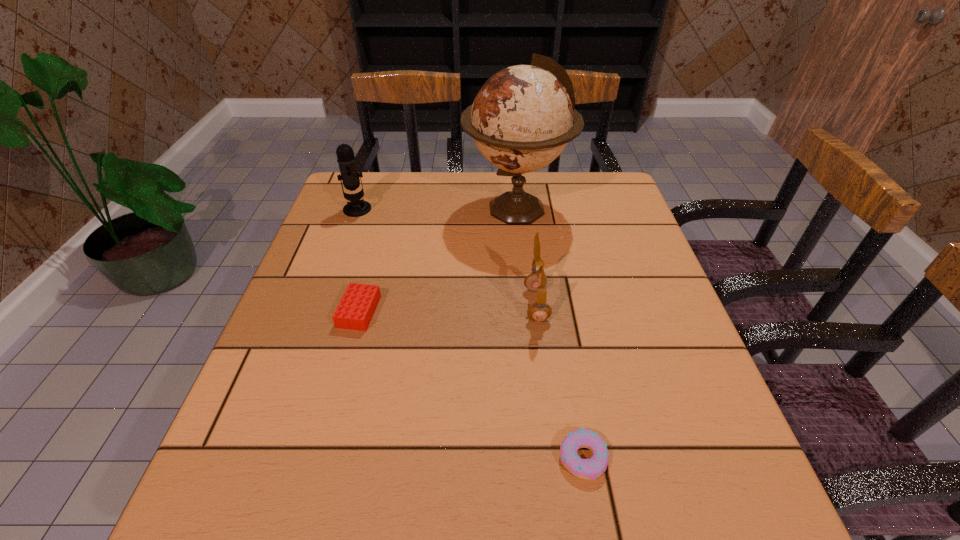
I want to click on free space located 0.240m on the front of the globe showing Asia, so click(x=379, y=208).

This screenshot has width=960, height=540. Find the location of `free location located 0.240m on the right of the leftmost object`. free location located 0.240m on the right of the leftmost object is located at coordinates (455, 210).

In order to click on vacant region located 0.350m on the front-facing side of the third tallest object in this screenshot , I will do `click(368, 305)`.

You are a GUI agent. You are given a task and a screenshot of the screen. Output one action in this format:
    pyautogui.click(x=<x>, y=<y>)
    Task: Click on the vacant area situated 0.270m on the front-facing side of the third tallest object
    The image size is (960, 540).
    Given the screenshot: What is the action you would take?
    pyautogui.click(x=403, y=305)

The height and width of the screenshot is (540, 960). Find the location of `vacant region located 0.060m on the front-facing side of the third tallest object`. vacant region located 0.060m on the front-facing side of the third tallest object is located at coordinates (497, 305).

Locate an element on the screen. This screenshot has height=540, width=960. free region located 0.180m on the back of the fourth object from right to left is located at coordinates (377, 244).

Locate an element on the screen. free space located on the left of the doughnut is located at coordinates (450, 457).

Locate an element on the screen. globe located at the far edge is located at coordinates (522, 118).

The width and height of the screenshot is (960, 540). In order to click on microphone that is at the far edge in this screenshot , I will do `click(346, 160)`.

Locate an element on the screen. Image resolution: width=960 pixels, height=540 pixels. object that is at the near edge is located at coordinates (590, 469).